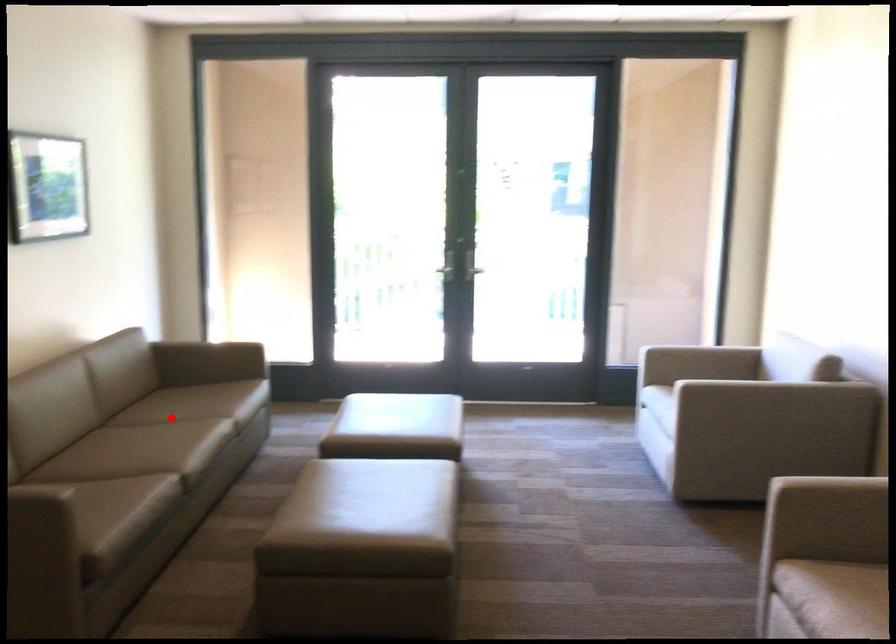
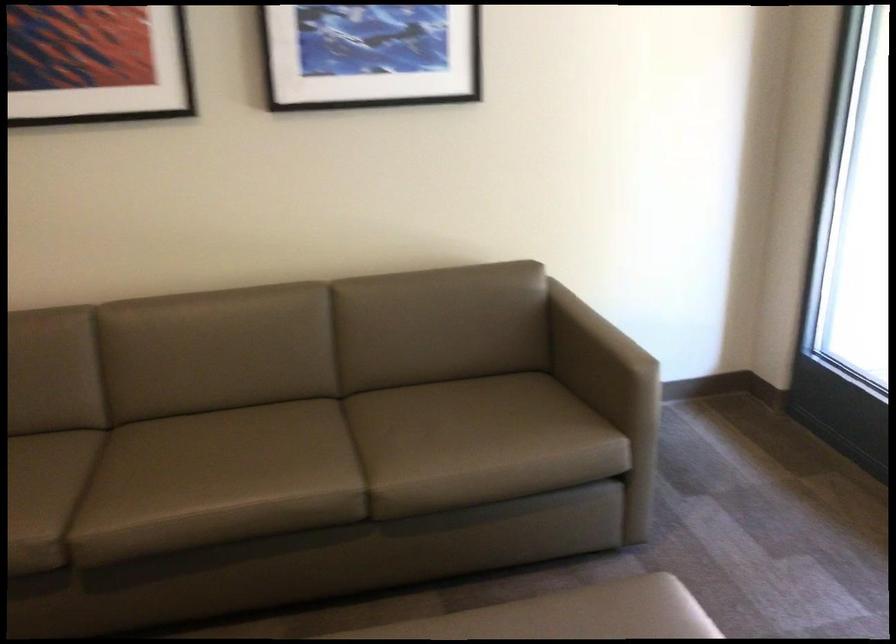
The point at the highlighted location is marked in the first image. Where is the corresponding point in the second image?

(356, 450)